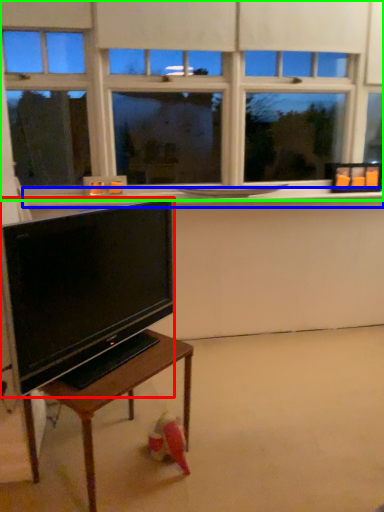
Question: Which is farther away from television (highlighted by a red box)? window sill (highlighted by a blue box) or window (highlighted by a green box)?

Choices:
 (A) window sill
 (B) window

Answer: (B)